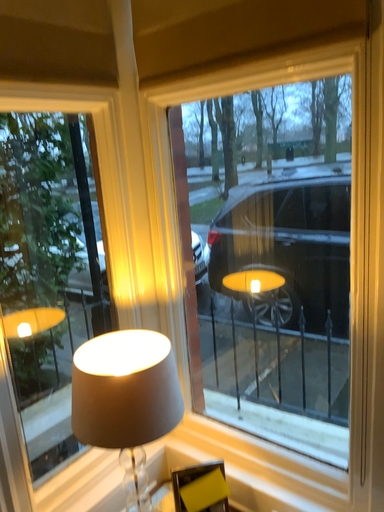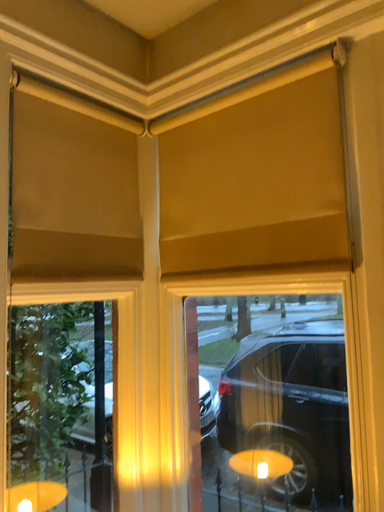
Question: Which way did the camera rotate in the video?

Choices:
 (A) rotated upward
 (B) rotated downward

Answer: (A)